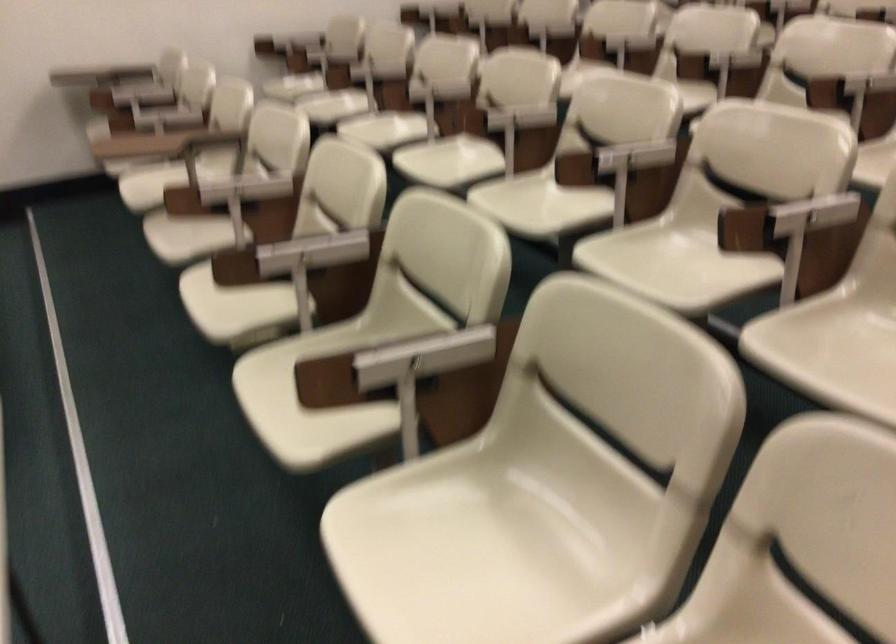
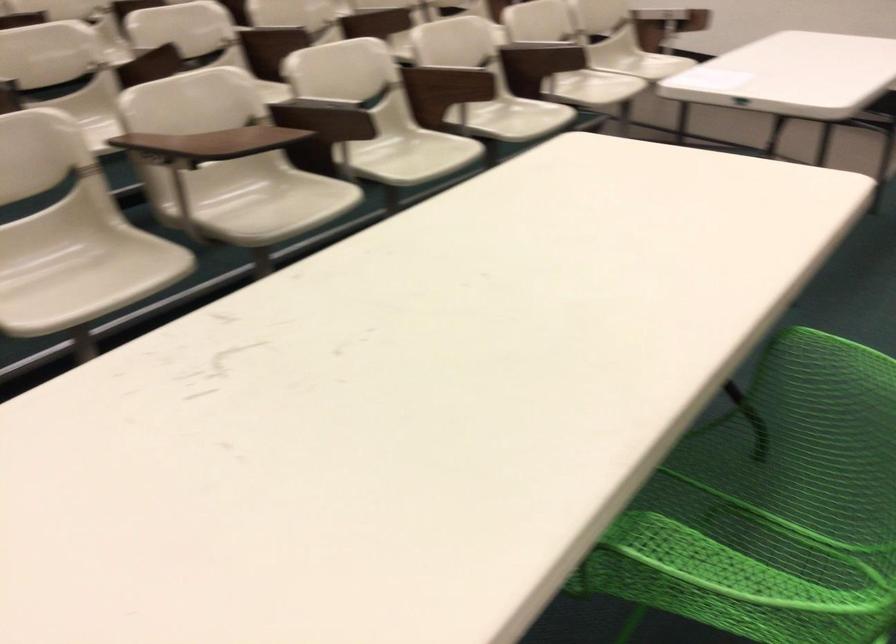
Where in the second image is the point corresponding to [317,248] from the first image?

(455, 73)